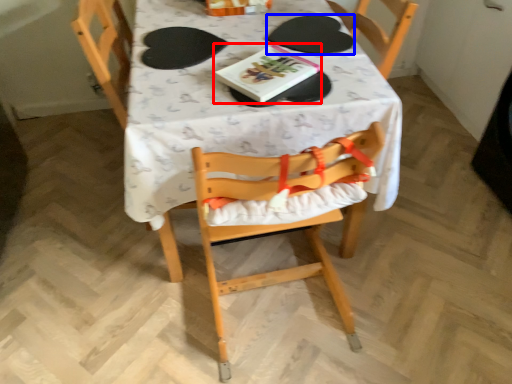
Question: Which of the following is the closest to the observer, book (highlighted by a red box) or paper plate (highlighted by a blue box)?

Choices:
 (A) book
 (B) paper plate

Answer: (A)